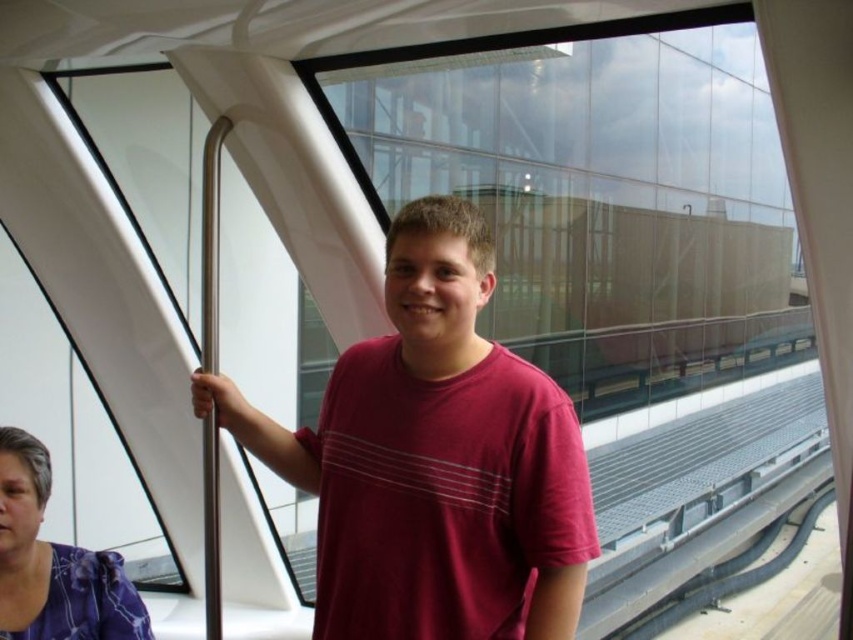
Question: Is matte red t-shirt at center bigger than purple floral blouse at lower left?

Choices:
 (A) no
 (B) yes

Answer: (B)

Question: Which point is farther from the camera taking this photo?

Choices:
 (A) (73, 632)
 (B) (361, 401)

Answer: (A)

Question: Does matte red t-shirt at center have a lesser width compared to purple floral blouse at lower left?

Choices:
 (A) yes
 (B) no

Answer: (B)

Question: Among these objects, which one is farthest from the camera?

Choices:
 (A) purple floral blouse at lower left
 (B) matte red t-shirt at center

Answer: (A)

Question: Which point is farther to the camera?

Choices:
 (A) (434, 406)
 (B) (6, 513)

Answer: (B)

Question: Does matte red t-shirt at center appear on the left side of purple floral blouse at lower left?

Choices:
 (A) no
 (B) yes

Answer: (A)